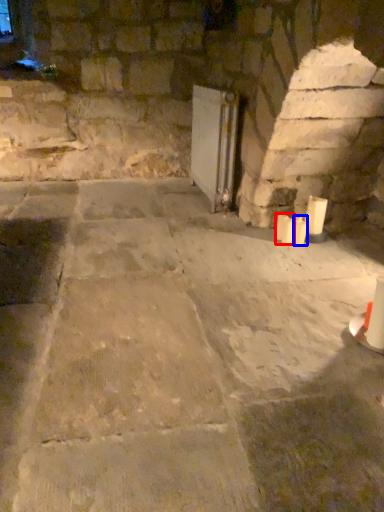
Question: Which of the following is the closest to the observer, candle (highlighted by a red box) or candle (highlighted by a blue box)?

Choices:
 (A) candle
 (B) candle

Answer: (A)